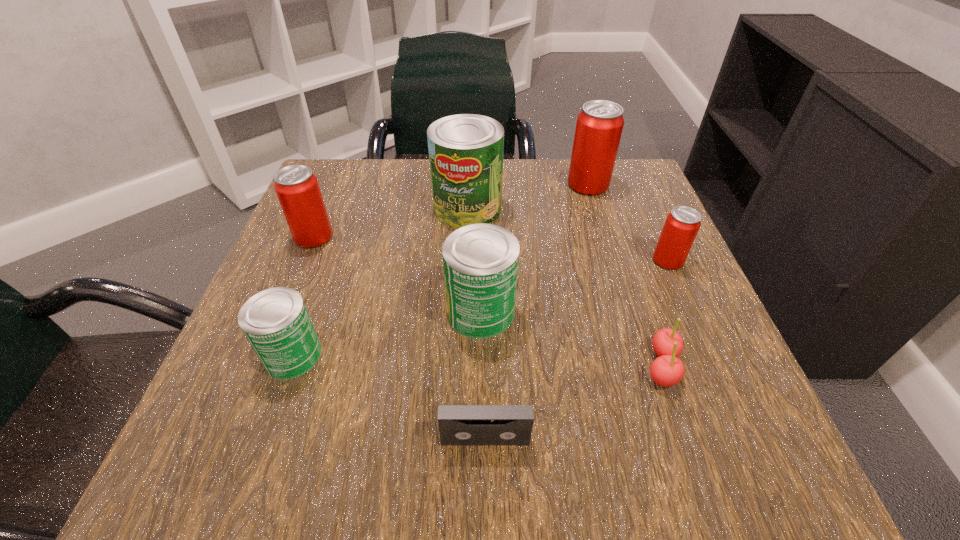
Locate an element on the screen. The image size is (960, 540). unoccupied position between the second smallest red can and the farthest green can is located at coordinates (391, 222).

You are a GUI agent. You are given a task and a screenshot of the screen. Output one action in this format:
    pyautogui.click(x=<x>, y=<y>)
    Task: Click on the vacant area between the videotape and the cherry
    This screenshot has height=540, width=960.
    Given the screenshot: What is the action you would take?
    pyautogui.click(x=573, y=402)

Where is `vacant space that is in between the rightmost red can and the biggest green can`? This screenshot has height=540, width=960. vacant space that is in between the rightmost red can and the biggest green can is located at coordinates (567, 234).

Find the location of `free space between the nearest object and the second smallest green can`. free space between the nearest object and the second smallest green can is located at coordinates (483, 375).

Where is `free space between the farthest red can and the red cherry`? Image resolution: width=960 pixels, height=540 pixels. free space between the farthest red can and the red cherry is located at coordinates (625, 275).

Identify which object is the fifth closest to the biggest green can. Please provide its 2D coordinates. Your answer should be formatted as a tuple, i.e. [(x, y)], where the tuple contains the x and y coordinates of a point satisfying the conditions above.

[(275, 321)]

This screenshot has width=960, height=540. Find the location of `object that is the fourth closest one to the second biggest green can`. object that is the fourth closest one to the second biggest green can is located at coordinates pos(275,321).

Select which can appears as the second closest to the farthest red can. Please provide its 2D coordinates. Your answer should be formatted as a tuple, i.e. [(x, y)], where the tuple contains the x and y coordinates of a point satisfying the conditions above.

[(682, 224)]

Identify which can is the second nearest to the leftmost red can. Please provide its 2D coordinates. Your answer should be formatted as a tuple, i.e. [(x, y)], where the tuple contains the x and y coordinates of a point satisfying the conditions above.

[(275, 321)]

Identify which red can is the third nearest to the biggest green can. Please provide its 2D coordinates. Your answer should be formatted as a tuple, i.e. [(x, y)], where the tuple contains the x and y coordinates of a point satisfying the conditions above.

[(682, 224)]